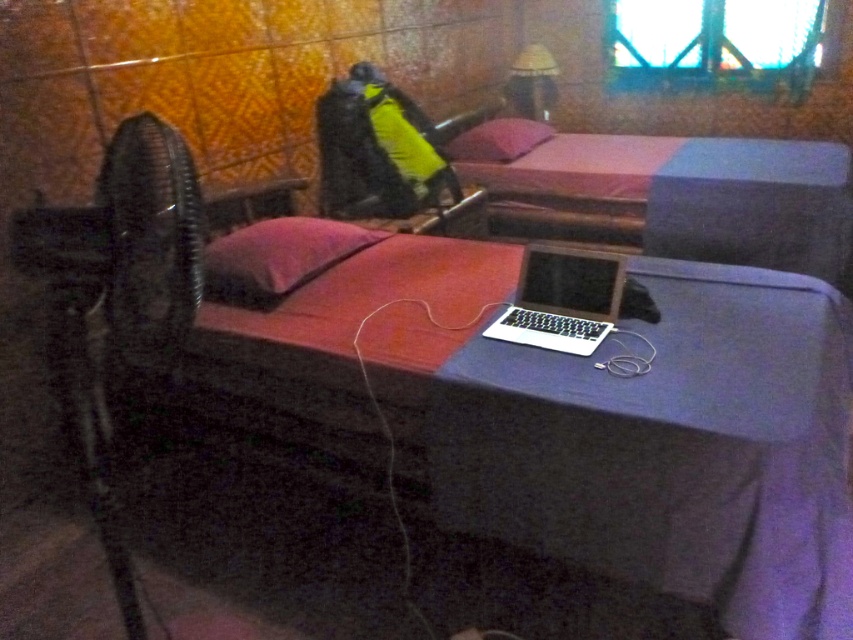
Question: Which of the following is the closest to the observer?

Choices:
 (A) matte yellow lampshade at upper center
 (B) blue fabric bed at center
 (C) pink fabric pillow at center

Answer: (C)

Question: Is black plastic fan at left to the left of pink fabric pillow at center from the viewer's perspective?

Choices:
 (A) no
 (B) yes

Answer: (B)

Question: Does blue fabric bed at center appear over black plastic fan at left?

Choices:
 (A) no
 (B) yes

Answer: (B)

Question: Which point is closer to the camera?

Choices:
 (A) (202, 260)
 (B) (519, 104)
 (C) (527, 337)
 (D) (125, 180)

Answer: (D)

Question: Which point is closer to the camera taking this photo?

Choices:
 (A) (643, 188)
 (B) (543, 250)

Answer: (B)

Question: Can you confirm if black plastic fan at left is positioned to the right of matte yellow lampshade at upper center?

Choices:
 (A) yes
 (B) no

Answer: (B)